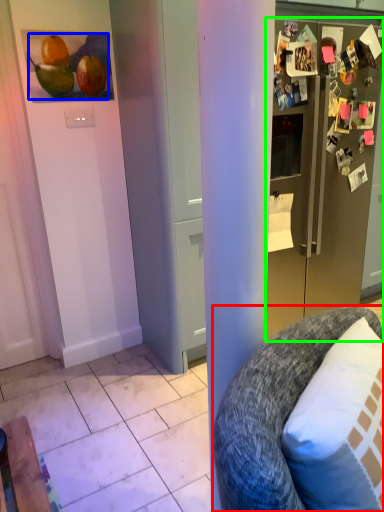
Question: Which object is positioned farthest from chair (highlighted by a red box)? Select from fruit (highlighted by a blue box) and refrigerator (highlighted by a green box).

Choices:
 (A) fruit
 (B) refrigerator

Answer: (A)